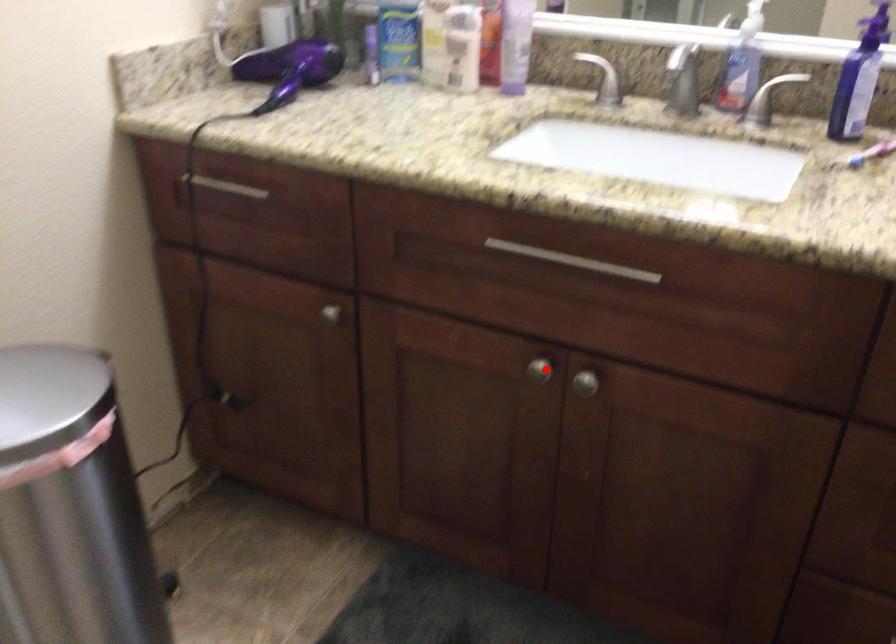
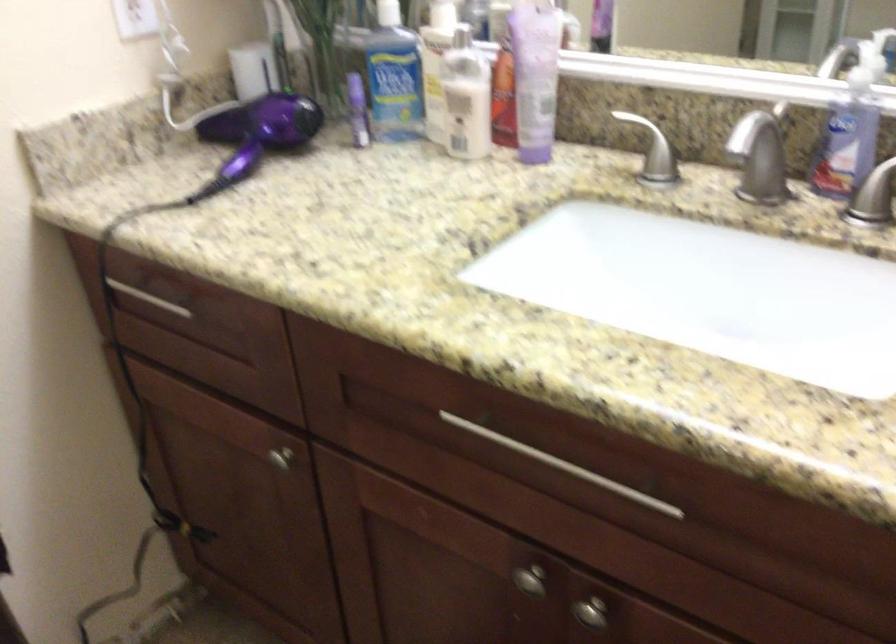
In the second image, find the point that corresponds to the highlighted location in the first image.

(530, 580)